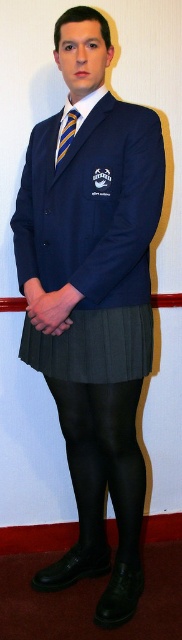
Question: Observing the image, what is the correct spatial positioning of dark grey pleated skirt at center in reference to striped fabric tie at center?

Choices:
 (A) below
 (B) above

Answer: (A)

Question: Which of the following is the farthest from the observer?

Choices:
 (A) (97, 317)
 (B) (135, 560)

Answer: (B)

Question: Which of these objects is positioned farthest from the dark grey pleated skirt at center?

Choices:
 (A) striped fabric tie at center
 (B) black tights at lower center

Answer: (A)

Question: Can you confirm if black tights at lower center is positioned to the left of dark grey pleated skirt at center?

Choices:
 (A) yes
 (B) no

Answer: (B)

Question: Among these objects, which one is nearest to the camera?

Choices:
 (A) dark grey pleated skirt at center
 (B) striped fabric tie at center

Answer: (A)

Question: Is the position of black tights at lower center more distant than that of striped fabric tie at center?

Choices:
 (A) yes
 (B) no

Answer: (A)